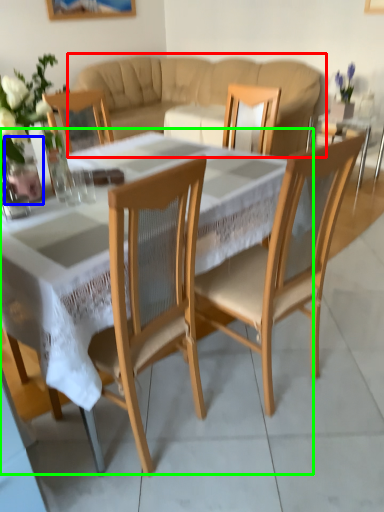
Question: Which object is positioned closest to studio couch (highlighted by a red box)? Select from glass vase (highlighted by a blue box) and coffee table (highlighted by a green box).

Choices:
 (A) glass vase
 (B) coffee table

Answer: (B)